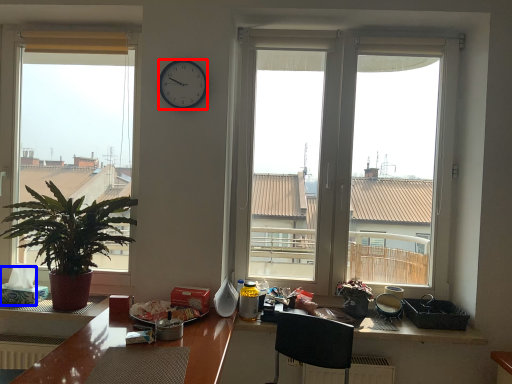
Question: Among these objects, which one is nearest to the camera, clock (highlighted by a red box) or tissue paper (highlighted by a blue box)?

Choices:
 (A) clock
 (B) tissue paper

Answer: (A)